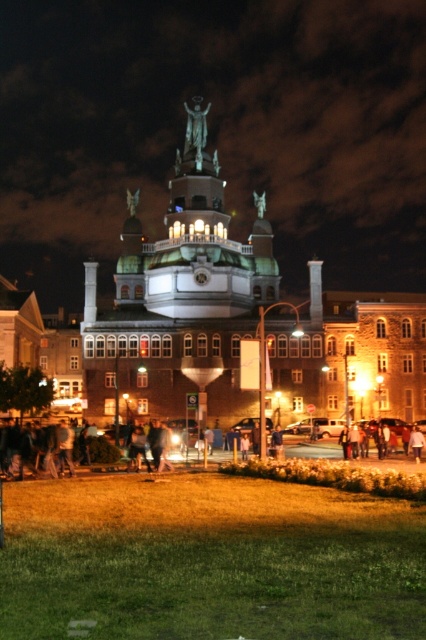
Question: Is dark clothing at lower center bigger than polished bronze statue at center?

Choices:
 (A) yes
 (B) no

Answer: (A)

Question: Does dark clothing at lower center appear on the left side of polished bronze statue at center?

Choices:
 (A) no
 (B) yes

Answer: (A)

Question: Which point is farther to the camera?

Choices:
 (A) (195, 156)
 (B) (411, 480)

Answer: (A)

Question: Where is dark clothing at lower center located in relation to polished bronze statue at center in the image?

Choices:
 (A) left
 (B) right

Answer: (B)

Question: Which point appears farthest from the camera in this image?

Choices:
 (A) (186, 104)
 (B) (305, 464)

Answer: (A)